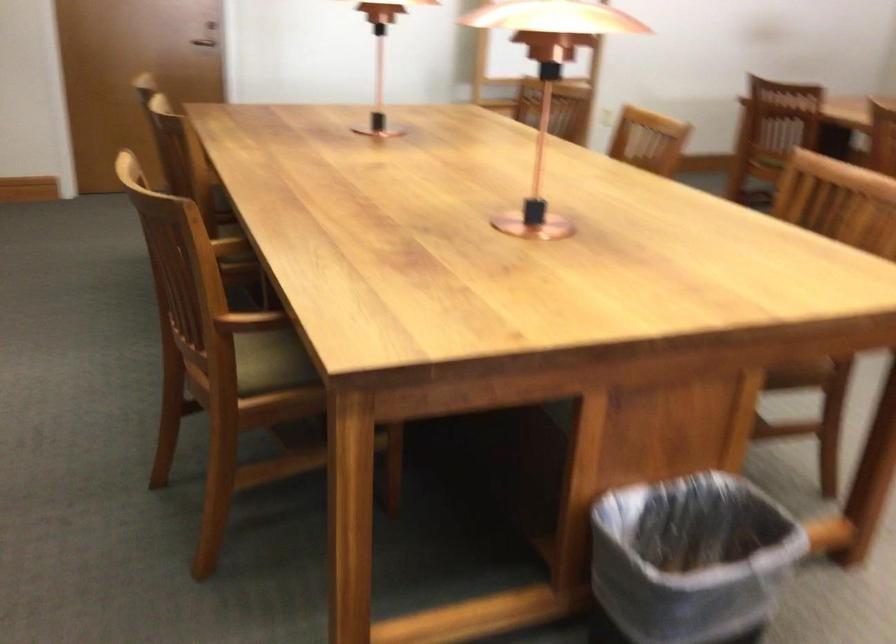
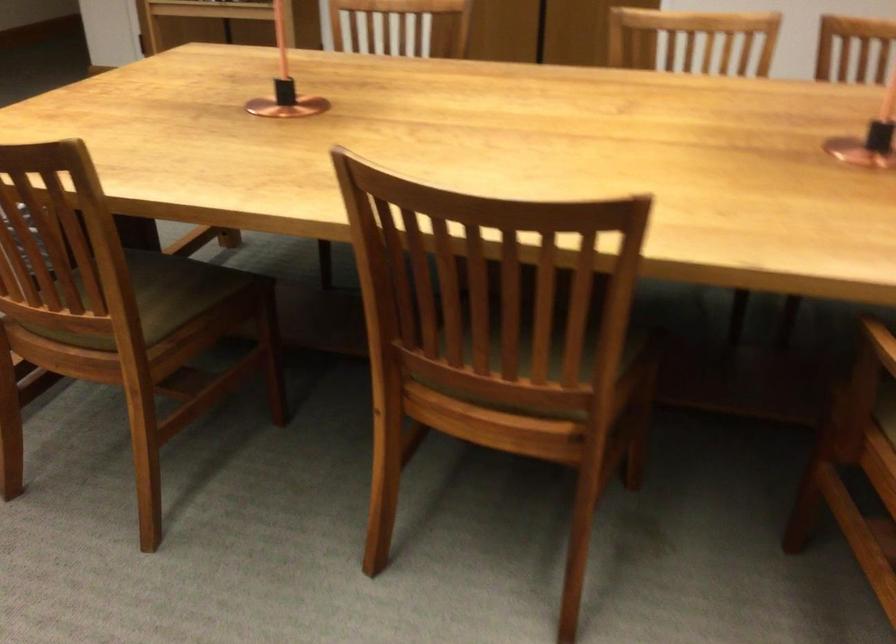
Locate, in the second image, the point that corresponds to point 530,201 in the first image.

(285, 84)